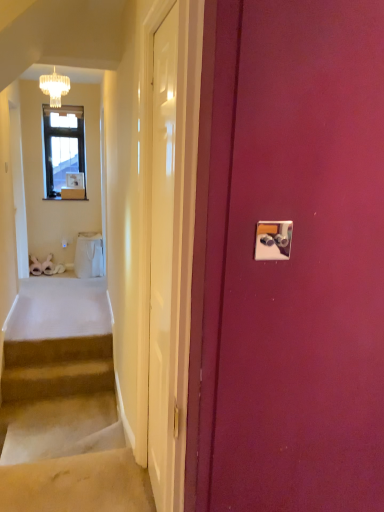
At what (x,y) coordinates should I click in order to perform the action: click on blank space situated above beige carpeted stairs at lower left, which is counted as the first stairs, starting from the bottom (from a real-world perspective). Please return your answer as a coordinate pair (x, y). The height and width of the screenshot is (512, 384). Looking at the image, I should click on (56, 422).